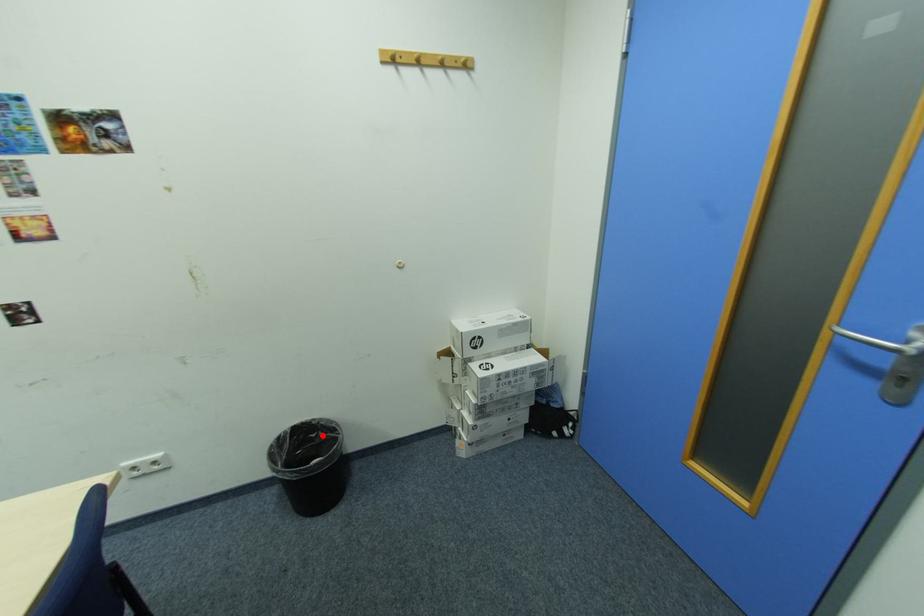
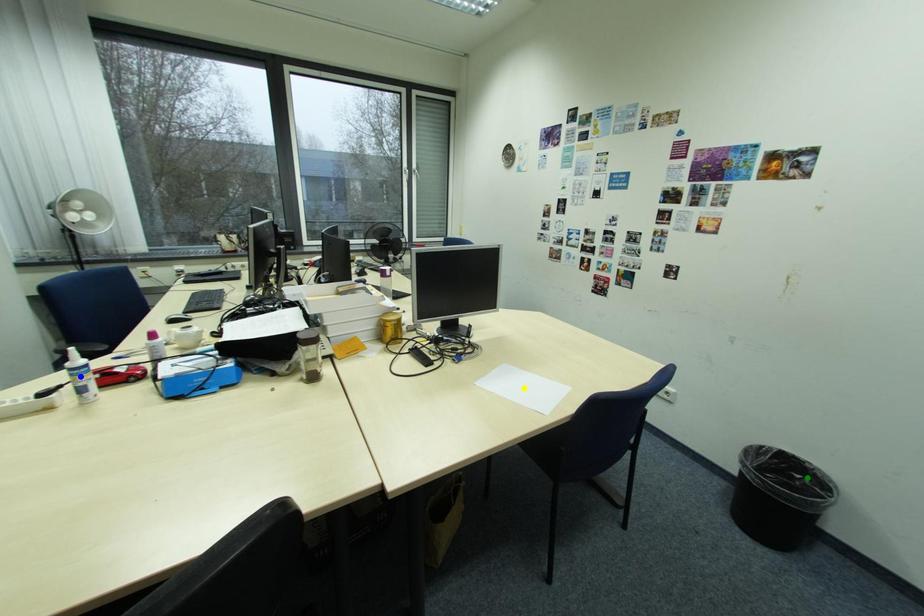
Question: I am providing you with two images of the same scene from different viewpoints. A red point is marked on the first image. You are given multiple points on the second image. In image 2, which mark is for the same physical point as the one in image 1?

Choices:
 (A) green point
 (B) blue point
 (C) yellow point

Answer: (A)